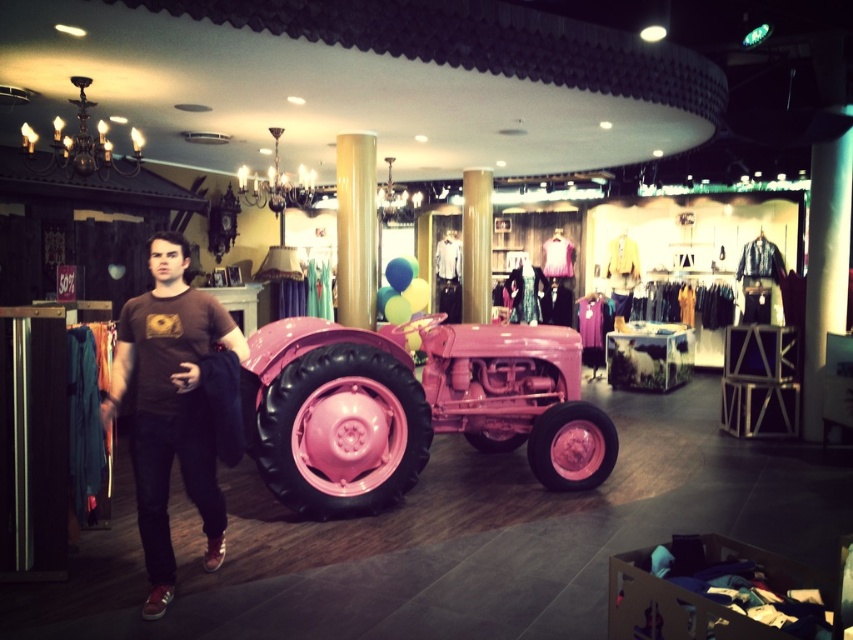
You are standing in the clothing store and want to take a photo of the pink tractor. The store has a rule that you must stay at least 15 feet away from the pink tractor to avoid disturbing the display. Is your current position at point (519, 426) safe to take the photo?

The distance of point (519, 426) from camera is 17.44 feet, which is more than the required 15 feet. Therefore, your current position is safe to take the photo without violating the store rule.